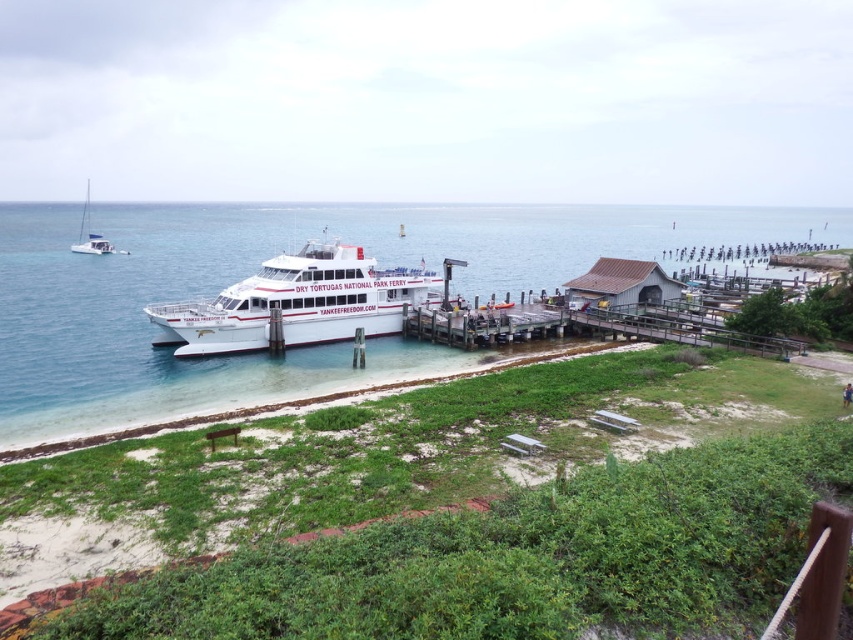
Looking at this image, who is more distant from viewer, (131, 403) or (80, 241)?

The point (80, 241) is behind.

You are a GUI agent. You are given a task and a screenshot of the screen. Output one action in this format:
    pyautogui.click(x=<x>, y=<y>)
    Task: Click on the clear blue water at center
    The width and height of the screenshot is (853, 640).
    Given the screenshot: What is the action you would take?
    coord(259,268)

Is white matte ferry at center positioned in front of white glossy sailboat at upper left?

Yes, it is in front of white glossy sailboat at upper left.

Who is more distant from viewer, [322,278] or [73,252]?

Positioned behind is point [73,252].

Is point (331, 272) closer to camera compared to point (77, 250)?

That is True.

Image resolution: width=853 pixels, height=640 pixels. In order to click on white matte ferry at center in this screenshot , I will do `click(299, 301)`.

Who is more distant from viewer, [51,417] or [244,310]?

The point [244,310] is more distant.

Between clear blue water at center and white matte ferry at center, which one appears on the right side from the viewer's perspective?

From the viewer's perspective, white matte ferry at center appears more on the right side.

The height and width of the screenshot is (640, 853). In order to click on clear blue water at center in this screenshot , I will do `click(259, 268)`.